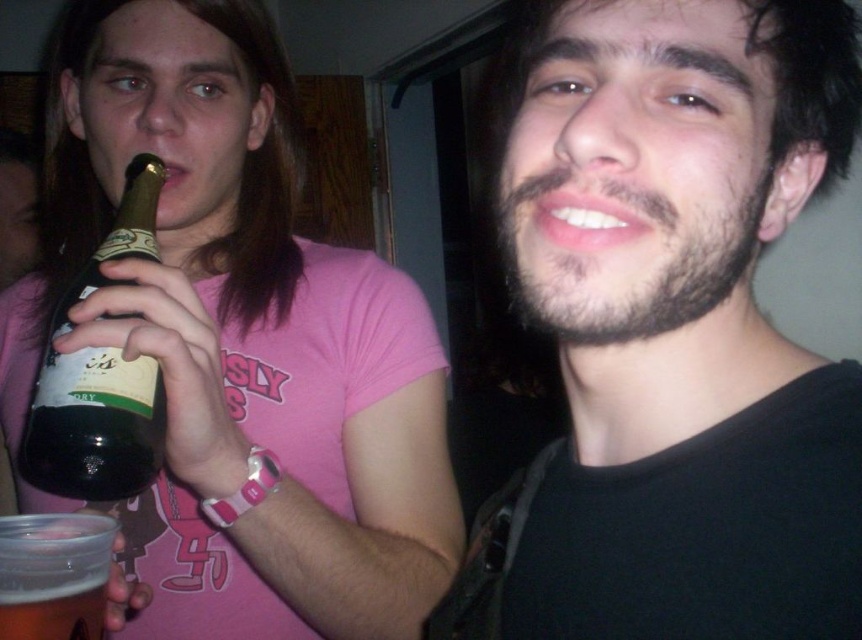
Is dark brown beard at center smaller than clear plastic cup at lower left?

Incorrect, dark brown beard at center is not smaller in size than clear plastic cup at lower left.

Is point (700, 1) farther from camera compared to point (60, 611)?

That is False.

Does point (678, 42) come closer to viewer compared to point (3, 611)?

Yes.

This screenshot has width=862, height=640. I want to click on dark brown beard at center, so click(x=671, y=330).

Does point (373, 490) come behind point (1, 602)?

That is True.

Describe the element at coordinates (241, 348) in the screenshot. The width and height of the screenshot is (862, 640). I see `matte black beer bottle at left` at that location.

Does point (79, 212) lie behind point (92, 605)?

Yes, it is behind point (92, 605).

Where is `matte black beer bottle at left`? The image size is (862, 640). matte black beer bottle at left is located at coordinates (241, 348).

Looking at this image, who is positioned more to the left, green glass bottle at left or clear plastic cup at lower left?

From the viewer's perspective, green glass bottle at left appears more on the left side.

Locate an element on the screen. The image size is (862, 640). green glass bottle at left is located at coordinates (98, 376).